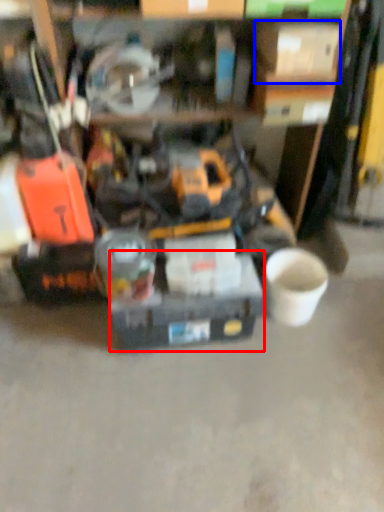
Question: Among these objects, which one is farthest to the camera, box (highlighted by a red box) or box (highlighted by a blue box)?

Choices:
 (A) box
 (B) box

Answer: (A)